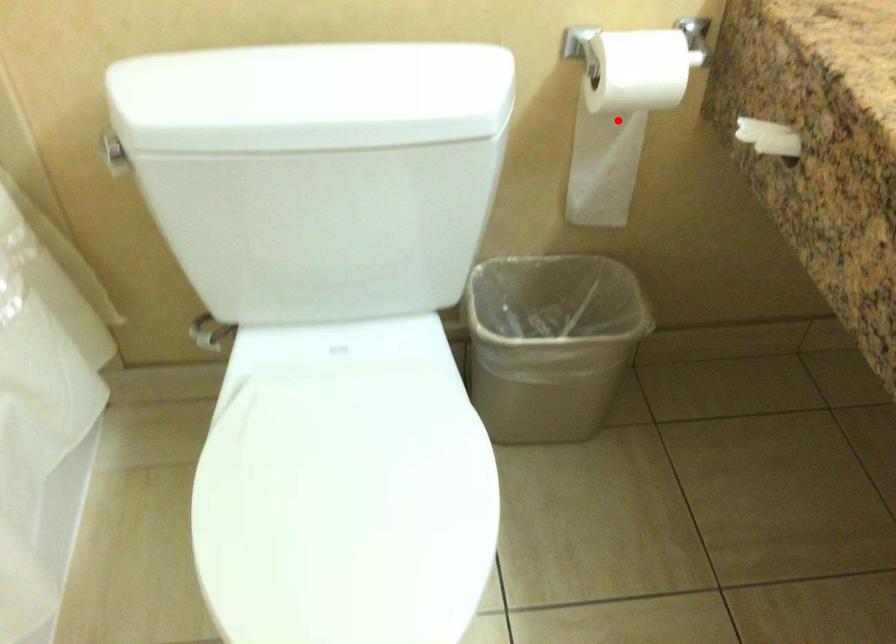
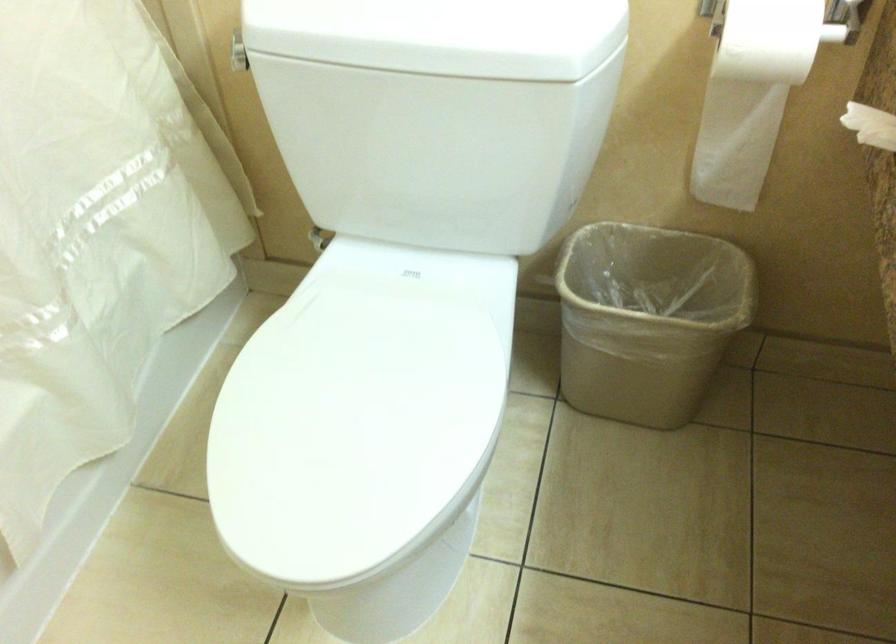
Where in the second image is the point corresponding to the highlighted location from the first image?

(752, 93)